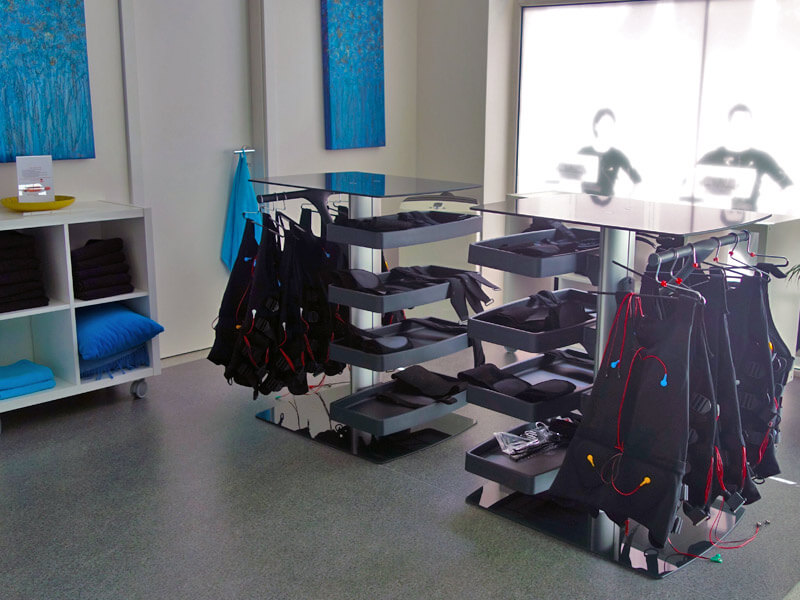
Identify the location of blue towel. This screenshot has width=800, height=600. (244, 199).